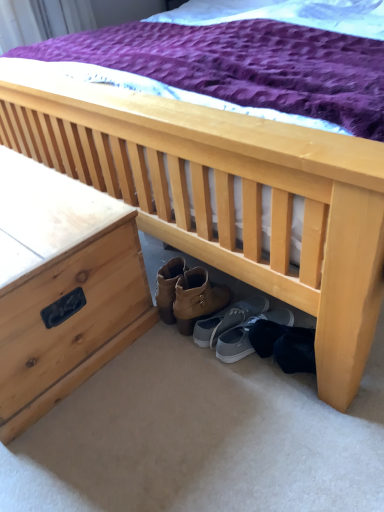
What do you see at coordinates (228, 320) in the screenshot?
I see `gray suede shoes at center, the first footwear when ordered from left to right` at bounding box center [228, 320].

What is the approximate height of gray fabric shoe at lower center, which is the second footwear in left-to-right order?

gray fabric shoe at lower center, which is the second footwear in left-to-right order, is 9.41 centimeters in height.

I want to click on natural wood nightstand at left, so click(61, 287).

How distant is natural wood nightstand at left from gray fabric shoe at lower center, which is the second footwear in left-to-right order?

They are 47.46 centimeters apart.

Locate an element on the screen. Image resolution: width=384 pixels, height=512 pixels. nightstand on the left of the gray fabric shoe at lower center, which is the 1th footwear from right to left is located at coordinates (61, 287).

Can you tell me how much natural wood nightstand at left and gray fabric shoe at lower center, which is the second footwear in left-to-right order, differ in facing direction?

The facing directions of natural wood nightstand at left and gray fabric shoe at lower center, which is the second footwear in left-to-right order, are 166 degrees apart.

Which of these two, natural wood nightstand at left or gray fabric shoe at lower center, which is the second footwear in left-to-right order, stands shorter?

With less height is gray fabric shoe at lower center, which is the second footwear in left-to-right order.

From the picture: Is gray fabric shoe at lower center, which is the 1th footwear from right to left, positioned beyond the bounds of natural wood nightstand at left?

Yes, gray fabric shoe at lower center, which is the 1th footwear from right to left, is not within natural wood nightstand at left.

Is gray fabric shoe at lower center, which is the second footwear in left-to-right order, with natural wood nightstand at left?

gray fabric shoe at lower center, which is the second footwear in left-to-right order, is not next to natural wood nightstand at left, and they're not touching.

Does point (220, 357) lie in front of point (36, 197)?

Yes, point (220, 357) is in front of point (36, 197).

From a real-world perspective, is gray fabric shoe at lower center, which is the 1th footwear from right to left, positioned above or below natural wood nightstand at left?

Clearly, from a real-world perspective, gray fabric shoe at lower center, which is the 1th footwear from right to left, is below natural wood nightstand at left.

Is gray fabric shoe at lower center, which is the second footwear in left-to-right order, positioned with its back to gray suede shoes at center, the first footwear when ordered from left to right?

gray fabric shoe at lower center, which is the second footwear in left-to-right order, is not turned away from gray suede shoes at center, the first footwear when ordered from left to right.

From the image's perspective, would you say gray fabric shoe at lower center, which is the 1th footwear from right to left, is shown under gray suede shoes at center, the second footwear from the right?

Yes, from the image's perspective, gray fabric shoe at lower center, which is the 1th footwear from right to left, is below gray suede shoes at center, the second footwear from the right.

From a real-world perspective, is gray fabric shoe at lower center, which is the 1th footwear from right to left, over gray suede shoes at center, the second footwear from the right?

No, from a real-world perspective, gray fabric shoe at lower center, which is the 1th footwear from right to left, is not on top of gray suede shoes at center, the second footwear from the right.

Is gray fabric shoe at lower center, which is the second footwear in left-to-right order, wider or thinner than gray suede shoes at center, the second footwear from the right?

In the image, gray fabric shoe at lower center, which is the second footwear in left-to-right order, appears to be wider than gray suede shoes at center, the second footwear from the right.

From a real-world perspective, is gray suede shoes at center, the second footwear from the right, on natural wood nightstand at left?

No, from a real-world perspective, gray suede shoes at center, the second footwear from the right, is not over natural wood nightstand at left

Who is smaller, gray suede shoes at center, the second footwear from the right, or natural wood nightstand at left?

Smaller between the two is gray suede shoes at center, the second footwear from the right.

Considering the sizes of objects gray suede shoes at center, the first footwear when ordered from left to right, and natural wood nightstand at left in the image provided, who is thinner, gray suede shoes at center, the first footwear when ordered from left to right, or natural wood nightstand at left?

With smaller width is gray suede shoes at center, the first footwear when ordered from left to right.

From the image's perspective, would you say natural wood nightstand at left is shown under gray suede shoes at center, the first footwear when ordered from left to right?

No.

Is point (73, 236) more distant than point (233, 305)?

That is False.

From a real-world perspective, which object stands above the other?

natural wood nightstand at left is physically above.

Relative to gray suede shoes at center, the second footwear from the right, is natural wood nightstand at left in front or behind?

Clearly, natural wood nightstand at left is in front of gray suede shoes at center, the second footwear from the right.

From a real-world perspective, is gray suede shoes at center, the first footwear when ordered from left to right, physically above gray fabric shoe at lower center, which is the second footwear in left-to-right order?

Indeed, from a real-world perspective, gray suede shoes at center, the first footwear when ordered from left to right, stands above gray fabric shoe at lower center, which is the second footwear in left-to-right order.

Is gray suede shoes at center, the second footwear from the right, positioned before gray fabric shoe at lower center, which is the second footwear in left-to-right order?

No, gray suede shoes at center, the second footwear from the right, is further to the viewer.

Is gray suede shoes at center, the first footwear when ordered from left to right, far from gray fabric shoe at lower center, which is the second footwear in left-to-right order?

No, gray suede shoes at center, the first footwear when ordered from left to right, is not far from gray fabric shoe at lower center, which is the second footwear in left-to-right order.

Which point is more forward, [235,310] or [224,355]?

The point [224,355] is closer to the camera.

At what (x,y) coordinates should I click in order to perform the action: click on nightstand in front of the gray fabric shoe at lower center, which is the 1th footwear from right to left. Please return your answer as a coordinate pair (x, y). Looking at the image, I should click on (61, 287).

Image resolution: width=384 pixels, height=512 pixels. In order to click on nightstand above the gray fabric shoe at lower center, which is the 1th footwear from right to left (from a real-world perspective) in this screenshot , I will do `click(61, 287)`.

Considering their positions, is natural wood nightstand at left positioned further to gray suede shoes at center, the first footwear when ordered from left to right, than gray fabric shoe at lower center, which is the second footwear in left-to-right order?

Among the two, natural wood nightstand at left is located further to gray suede shoes at center, the first footwear when ordered from left to right.

Looking at the image, which one is located further to natural wood nightstand at left, gray fabric shoe at lower center, which is the second footwear in left-to-right order, or gray suede shoes at center, the first footwear when ordered from left to right?

Based on the image, gray fabric shoe at lower center, which is the second footwear in left-to-right order, appears to be further to natural wood nightstand at left.

When comparing their distances from gray fabric shoe at lower center, which is the second footwear in left-to-right order, does gray suede shoes at center, the first footwear when ordered from left to right, or natural wood nightstand at left seem further?

Among the two, natural wood nightstand at left is located further to gray fabric shoe at lower center, which is the second footwear in left-to-right order.

Estimate the real-world distances between objects in this image. Which object is closer to gray fabric shoe at lower center, which is the second footwear in left-to-right order, natural wood nightstand at left or gray suede shoes at center, the second footwear from the right?

Based on the image, gray suede shoes at center, the second footwear from the right, appears to be nearer to gray fabric shoe at lower center, which is the second footwear in left-to-right order.

Considering their positions, is gray fabric shoe at lower center, which is the 1th footwear from right to left, positioned closer to gray suede shoes at center, the first footwear when ordered from left to right, than natural wood nightstand at left?

gray fabric shoe at lower center, which is the 1th footwear from right to left, lies closer to gray suede shoes at center, the first footwear when ordered from left to right, than the other object.

Which object lies further to the anchor point natural wood nightstand at left, gray suede shoes at center, the second footwear from the right, or gray fabric shoe at lower center, which is the 1th footwear from right to left?

gray fabric shoe at lower center, which is the 1th footwear from right to left, lies further to natural wood nightstand at left than the other object.

Image resolution: width=384 pixels, height=512 pixels. In order to click on footwear between natural wood nightstand at left and gray fabric shoe at lower center, which is the 1th footwear from right to left in this screenshot , I will do `click(228, 320)`.